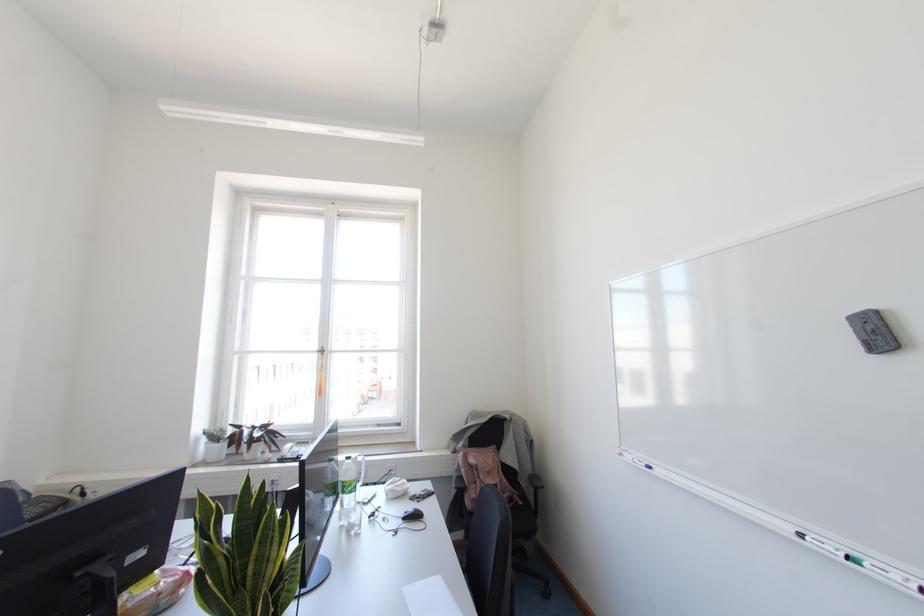
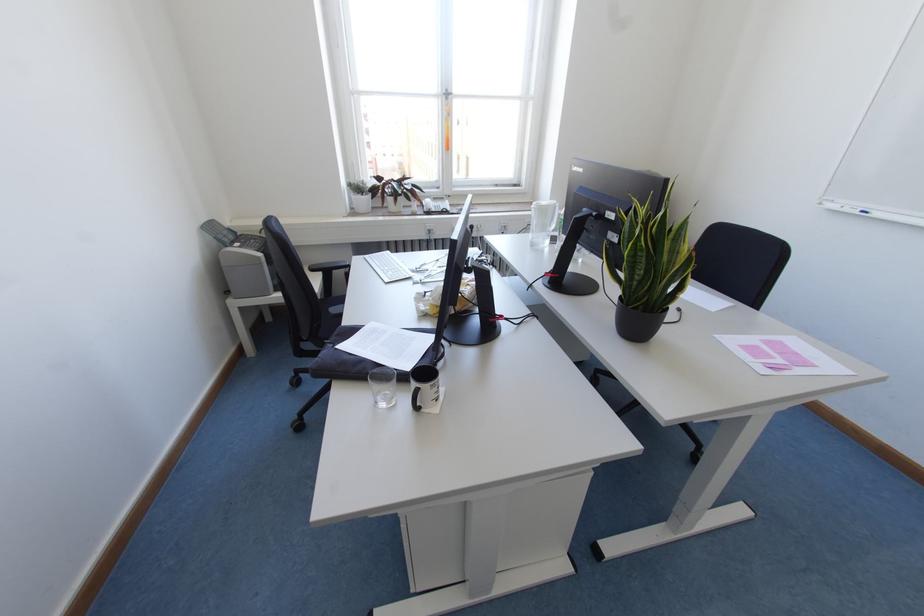
Locate, in the second image, the point that corresponds to (x=322, y=353) in the first image.

(446, 98)